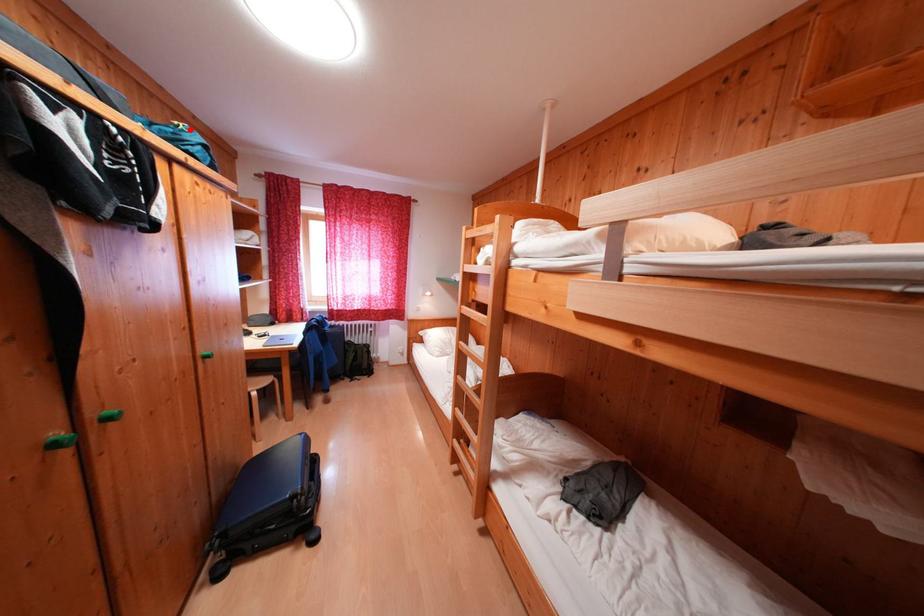
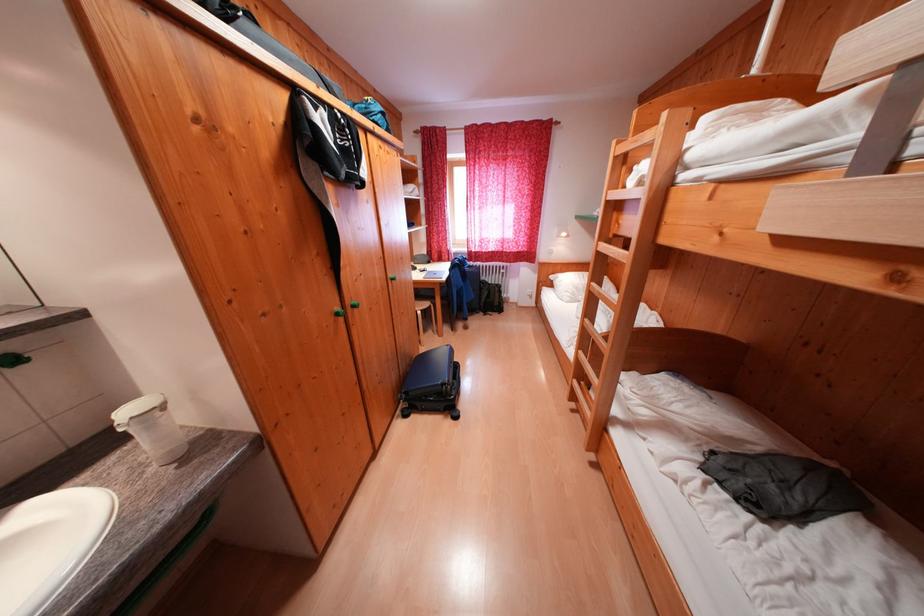
Locate, in the second image, the point that corresponds to the highlighted location in the first image.

(378, 103)